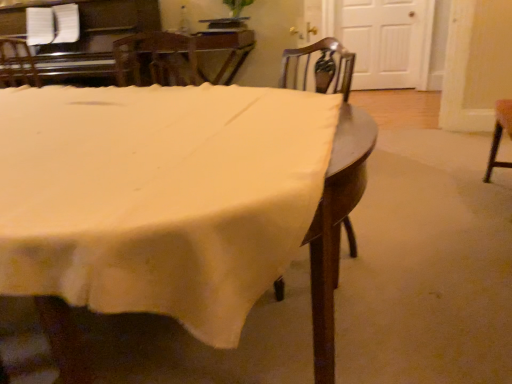
Locate an element on the screen. This screenshot has height=384, width=512. vacant area that is in front of wooden at center is located at coordinates (334, 311).